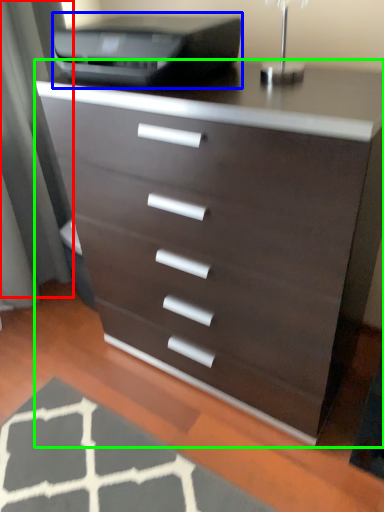
Question: Based on their relative distances, which object is farther from screen door (highlighted by a red box)? Choose from printer (highlighted by a blue box) and chest of drawers (highlighted by a green box).

Choices:
 (A) printer
 (B) chest of drawers

Answer: (B)